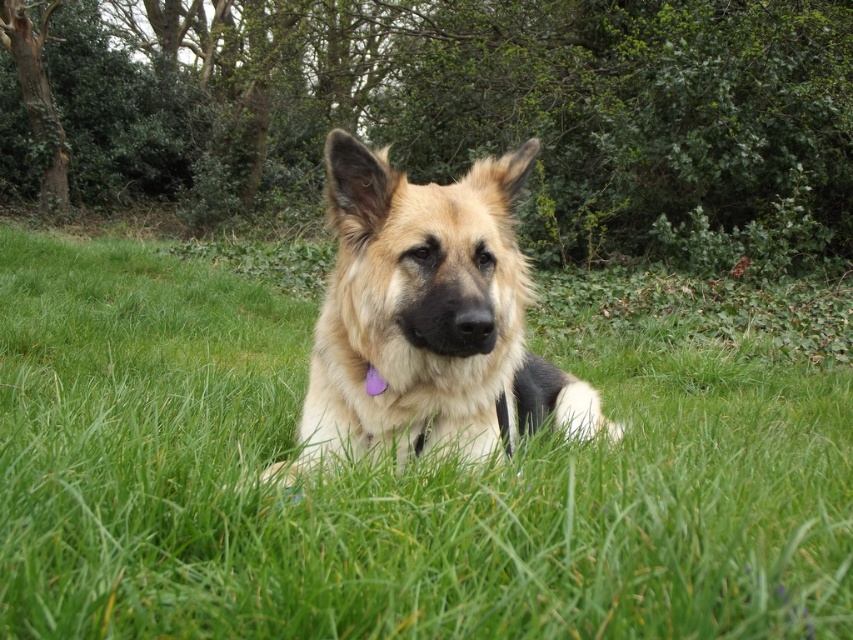
You are a photographer trying to capture the golden fur dog at center while ensuring the green grass at center is visible in the background. Can you focus on the dog and still have the grass in the background clearly visible?

The golden fur dog at center is behind green grass at center, so focusing on the dog would place the grass in front of it. This might make the grass blurry if the depth of field is shallow, but with proper camera settings, both could be in focus depending on the aperture and focal length used.

You are a photographer trying to capture a closeup of the golden fur dog at center. Since the green grass at center is in the way, can you adjust your camera angle to focus on the dog without the grass being in the shot?

The green grass at center is located below the golden fur dog at center, so you can adjust your camera angle upwards to focus on the dog without the grass obstructing the shot.